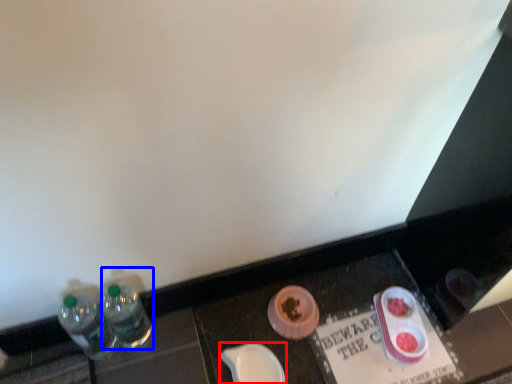
Question: Which object is further to the camera taking this photo, tableware (highlighted by a red box) or bottle (highlighted by a blue box)?

Choices:
 (A) tableware
 (B) bottle

Answer: (A)